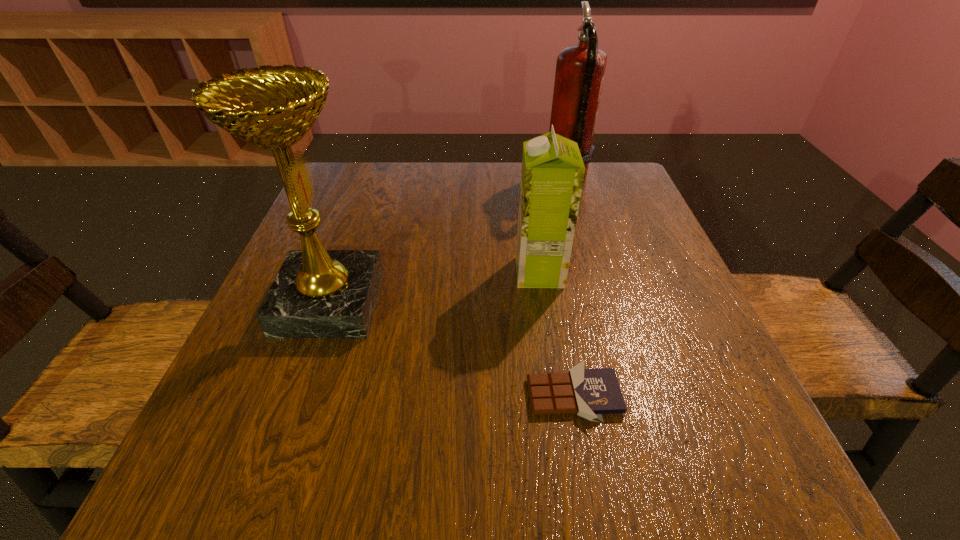
This screenshot has width=960, height=540. In order to click on vacant area situated 0.400m on the back of the shortest object in this screenshot , I will do `click(542, 222)`.

You are a GUI agent. You are given a task and a screenshot of the screen. Output one action in this format:
    pyautogui.click(x=<x>, y=<y>)
    Task: Click on the object that is positioned at the far edge
    
    Given the screenshot: What is the action you would take?
    coord(580,69)

Where is `object that is at the left edge`? The image size is (960, 540). object that is at the left edge is located at coordinates (317, 293).

You are a GUI agent. You are given a task and a screenshot of the screen. Output one action in this format:
    pyautogui.click(x=<x>, y=<y>)
    Task: Click on the object that is at the right edge
    This screenshot has width=960, height=540.
    Given the screenshot: What is the action you would take?
    pyautogui.click(x=580, y=69)

Locate an element on the screen. The height and width of the screenshot is (540, 960). object that is at the far right corner is located at coordinates (580, 69).

Where is `vacant region at the far edge of the desktop`? This screenshot has height=540, width=960. vacant region at the far edge of the desktop is located at coordinates (454, 171).

Locate an element on the screen. vacant space at the left edge of the desktop is located at coordinates (289, 360).

Where is `vacant area at the right edge of the desktop`? This screenshot has width=960, height=540. vacant area at the right edge of the desktop is located at coordinates (635, 265).

Locate an element on the screen. Image resolution: width=960 pixels, height=540 pixels. free space at the far left corner of the desktop is located at coordinates (345, 208).

You are a GUI agent. You are given a task and a screenshot of the screen. Output one action in this format:
    pyautogui.click(x=<x>, y=<y>)
    Task: Click on the free point at the near right corner
    The width and height of the screenshot is (960, 540).
    Given the screenshot: What is the action you would take?
    pyautogui.click(x=714, y=449)